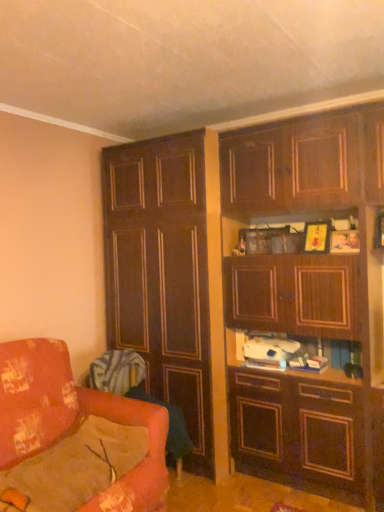
Describe the element at coordinates (169, 428) in the screenshot. I see `velvet orange swivel chair at lower left, the second swivel chair from the top` at that location.

The image size is (384, 512). What do you see at coordinates (138, 396) in the screenshot?
I see `velvet orange swivel chair at lower left, arranged as the 1th swivel chair when viewed from the top` at bounding box center [138, 396].

Find the location of a particular element. Image resolution: width=384 pixels, height=512 pixels. velvet orange swivel chair at lower left, arranged as the 1th swivel chair when viewed from the top is located at coordinates (138, 396).

Find the location of a particular element. Image resolution: width=384 pixels, height=512 pixels. dark wood cabinet at left, the first cabinetry in the left-to-right sequence is located at coordinates (162, 274).

Where is `velvet orange swivel chair at lower left, acting as the 1th swivel chair starting from the bottom`? The height and width of the screenshot is (512, 384). velvet orange swivel chair at lower left, acting as the 1th swivel chair starting from the bottom is located at coordinates (169, 428).

Visually, is floral fabric couch at lower left positioned to the left or to the right of velvet orange swivel chair at lower left, the second swivel chair from the top?

Based on their positions, floral fabric couch at lower left is located to the left of velvet orange swivel chair at lower left, the second swivel chair from the top.

From the image's perspective, is floral fabric couch at lower left located above velvet orange swivel chair at lower left, acting as the 1th swivel chair starting from the bottom?

Yes, from the image's perspective, floral fabric couch at lower left is on top of velvet orange swivel chair at lower left, acting as the 1th swivel chair starting from the bottom.

Considering the points (123, 502) and (181, 472), which point is behind, point (123, 502) or point (181, 472)?

The point (181, 472) is farther.

How far apart are floral fabric couch at lower left and velvet orange swivel chair at lower left, the second swivel chair from the top?

They are 25.42 inches apart.

Is velvet orange swivel chair at lower left, the second swivel chair from the top, facing towards floral fabric couch at lower left?

No, velvet orange swivel chair at lower left, the second swivel chair from the top, does not turn towards floral fabric couch at lower left.

Is velvet orange swivel chair at lower left, the second swivel chair from the top, in front of or behind floral fabric couch at lower left in the image?

velvet orange swivel chair at lower left, the second swivel chair from the top, is positioned farther from the viewer than floral fabric couch at lower left.

From a real-world perspective, is velvet orange swivel chair at lower left, the second swivel chair from the top, above or below floral fabric couch at lower left?

velvet orange swivel chair at lower left, the second swivel chair from the top, is below floral fabric couch at lower left.

Starting from the floral fabric couch at lower left, which swivel chair is the 2nd one to the right? Please provide its 2D coordinates.

[(169, 428)]

Is dark wood cabinet at left, positioned as the 2th cabinetry in right-to-left order, at the right side of wooden cabinet at upper right, arranged as the 1th cabinetry when viewed from the right?

No.

Is dark wood cabinet at left, positioned as the 2th cabinetry in right-to-left order, far from wooden cabinet at upper right, which ranks as the second cabinetry in left-to-right order?

Actually, dark wood cabinet at left, positioned as the 2th cabinetry in right-to-left order, and wooden cabinet at upper right, which ranks as the second cabinetry in left-to-right order, are a little close together.

From a real-world perspective, who is located lower, dark wood cabinet at left, the first cabinetry in the left-to-right sequence, or wooden cabinet at upper right, arranged as the 1th cabinetry when viewed from the right?

From a 3D spatial view, dark wood cabinet at left, the first cabinetry in the left-to-right sequence, is below.

What's the angular difference between dark wood cabinet at left, the first cabinetry in the left-to-right sequence, and wooden cabinet at upper right, which ranks as the second cabinetry in left-to-right order,'s facing directions?

The angle between the facing direction of dark wood cabinet at left, the first cabinetry in the left-to-right sequence, and the facing direction of wooden cabinet at upper right, which ranks as the second cabinetry in left-to-right order, is 0.000155 degrees.

Which is farther from the camera, (x=169, y=436) or (x=136, y=424)?

The point (x=169, y=436) is more distant.

Is velvet orange swivel chair at lower left, arranged as the 1th swivel chair when viewed from the top, spatially inside floral fabric couch at lower left, or outside of it?

velvet orange swivel chair at lower left, arranged as the 1th swivel chair when viewed from the top, lies outside floral fabric couch at lower left.

Can you see velvet orange swivel chair at lower left, arranged as the 1th swivel chair when viewed from the top, touching floral fabric couch at lower left?

No, velvet orange swivel chair at lower left, arranged as the 1th swivel chair when viewed from the top, is not making contact with floral fabric couch at lower left.

From a real-world perspective, is velvet orange swivel chair at lower left, the 2th swivel chair in the bottom-to-top sequence, on floral fabric couch at lower left?

No, from a real-world perspective, velvet orange swivel chair at lower left, the 2th swivel chair in the bottom-to-top sequence, is not on top of floral fabric couch at lower left.

Considering the positions of objects velvet orange swivel chair at lower left, the 2th swivel chair in the bottom-to-top sequence, and velvet orange swivel chair at lower left, the second swivel chair from the top, in the image provided, who is more to the left, velvet orange swivel chair at lower left, the 2th swivel chair in the bottom-to-top sequence, or velvet orange swivel chair at lower left, the second swivel chair from the top,?

velvet orange swivel chair at lower left, the 2th swivel chair in the bottom-to-top sequence, is more to the left.

Which is behind, point (129, 381) or point (174, 445)?

The point (129, 381) is farther.

The width and height of the screenshot is (384, 512). Find the location of `swivel chair above the velvet orange swivel chair at lower left, the second swivel chair from the top (from a real-world perspective)`. swivel chair above the velvet orange swivel chair at lower left, the second swivel chair from the top (from a real-world perspective) is located at coordinates (138, 396).

Between velvet orange swivel chair at lower left, arranged as the 1th swivel chair when viewed from the top, and velvet orange swivel chair at lower left, acting as the 1th swivel chair starting from the bottom, which one has smaller width?

Thinner between the two is velvet orange swivel chair at lower left, arranged as the 1th swivel chair when viewed from the top.

Would you say floral fabric couch at lower left is to the left or to the right of velvet orange swivel chair at lower left, arranged as the 1th swivel chair when viewed from the top, in the picture?

In the image, floral fabric couch at lower left appears on the left side of velvet orange swivel chair at lower left, arranged as the 1th swivel chair when viewed from the top.

Could you tell me if floral fabric couch at lower left is turned towards velvet orange swivel chair at lower left, the 2th swivel chair in the bottom-to-top sequence?

No, floral fabric couch at lower left is not facing towards velvet orange swivel chair at lower left, the 2th swivel chair in the bottom-to-top sequence.

Is floral fabric couch at lower left not inside velvet orange swivel chair at lower left, arranged as the 1th swivel chair when viewed from the top?

Yes, floral fabric couch at lower left is not within velvet orange swivel chair at lower left, arranged as the 1th swivel chair when viewed from the top.

In the image, is floral fabric couch at lower left positioned in front of or behind velvet orange swivel chair at lower left, arranged as the 1th swivel chair when viewed from the top?

In the image, floral fabric couch at lower left appears in front of velvet orange swivel chair at lower left, arranged as the 1th swivel chair when viewed from the top.

Relative to floral fabric couch at lower left, is dark wood cabinet at left, positioned as the 2th cabinetry in right-to-left order, in front or behind?

Clearly, dark wood cabinet at left, positioned as the 2th cabinetry in right-to-left order, is behind floral fabric couch at lower left.

From the image's perspective, which is above, dark wood cabinet at left, positioned as the 2th cabinetry in right-to-left order, or floral fabric couch at lower left?

From the image's view, dark wood cabinet at left, positioned as the 2th cabinetry in right-to-left order, is above.

Does dark wood cabinet at left, the first cabinetry in the left-to-right sequence, have a lesser width compared to floral fabric couch at lower left?

Correct, the width of dark wood cabinet at left, the first cabinetry in the left-to-right sequence, is less than that of floral fabric couch at lower left.

Is dark wood cabinet at left, positioned as the 2th cabinetry in right-to-left order, facing away from floral fabric couch at lower left?

That's not correct — dark wood cabinet at left, positioned as the 2th cabinetry in right-to-left order, is not looking away from floral fabric couch at lower left.

There is a velvet orange swivel chair at lower left, the second swivel chair from the top. Identify the location of studio couch above it (from a real-world perspective). The image size is (384, 512). (74, 439).

Find the location of a particular element. The image size is (384, 512). studio couch to the left of velvet orange swivel chair at lower left, the second swivel chair from the top is located at coordinates (74, 439).

In the scene shown: Which object lies nearer to the anchor point velvet orange swivel chair at lower left, the second swivel chair from the top, wooden cabinet at upper right, which ranks as the second cabinetry in left-to-right order, or dark wood cabinet at left, positioned as the 2th cabinetry in right-to-left order?

dark wood cabinet at left, positioned as the 2th cabinetry in right-to-left order.

Looking at the image, which one is located further to velvet orange swivel chair at lower left, the 2th swivel chair in the bottom-to-top sequence, wooden cabinet at upper right, which ranks as the second cabinetry in left-to-right order, or floral fabric couch at lower left?

Based on the image, wooden cabinet at upper right, which ranks as the second cabinetry in left-to-right order, appears to be further to velvet orange swivel chair at lower left, the 2th swivel chair in the bottom-to-top sequence.

Based on the photo, looking at the image, which one is located further to wooden cabinet at upper right, which ranks as the second cabinetry in left-to-right order, dark wood cabinet at left, positioned as the 2th cabinetry in right-to-left order, or velvet orange swivel chair at lower left, the 2th swivel chair in the bottom-to-top sequence?

Based on the image, velvet orange swivel chair at lower left, the 2th swivel chair in the bottom-to-top sequence, appears to be further to wooden cabinet at upper right, which ranks as the second cabinetry in left-to-right order.

Consider the image. Based on their spatial positions, is dark wood cabinet at left, positioned as the 2th cabinetry in right-to-left order, or velvet orange swivel chair at lower left, the second swivel chair from the top, further from wooden cabinet at upper right, which ranks as the second cabinetry in left-to-right order?

Among the two, velvet orange swivel chair at lower left, the second swivel chair from the top, is located further to wooden cabinet at upper right, which ranks as the second cabinetry in left-to-right order.

Estimate the real-world distances between objects in this image. Which object is further from wooden cabinet at upper right, which ranks as the second cabinetry in left-to-right order, dark wood cabinet at left, positioned as the 2th cabinetry in right-to-left order, or floral fabric couch at lower left?

Based on the image, floral fabric couch at lower left appears to be further to wooden cabinet at upper right, which ranks as the second cabinetry in left-to-right order.

Looking at the image, which one is located closer to floral fabric couch at lower left, wooden cabinet at upper right, arranged as the 1th cabinetry when viewed from the right, or dark wood cabinet at left, positioned as the 2th cabinetry in right-to-left order?

dark wood cabinet at left, positioned as the 2th cabinetry in right-to-left order, lies closer to floral fabric couch at lower left than the other object.

Which object lies nearer to the anchor point floral fabric couch at lower left, wooden cabinet at upper right, which ranks as the second cabinetry in left-to-right order, or velvet orange swivel chair at lower left, the 2th swivel chair in the bottom-to-top sequence?

The object closer to floral fabric couch at lower left is velvet orange swivel chair at lower left, the 2th swivel chair in the bottom-to-top sequence.

When comparing their distances from dark wood cabinet at left, the first cabinetry in the left-to-right sequence, does velvet orange swivel chair at lower left, acting as the 1th swivel chair starting from the bottom, or wooden cabinet at upper right, which ranks as the second cabinetry in left-to-right order, seem further?

Among the two, velvet orange swivel chair at lower left, acting as the 1th swivel chair starting from the bottom, is located further to dark wood cabinet at left, the first cabinetry in the left-to-right sequence.

Where is `swivel chair between dark wood cabinet at left, the first cabinetry in the left-to-right sequence, and velvet orange swivel chair at lower left, the second swivel chair from the top, in the up-down direction`? Image resolution: width=384 pixels, height=512 pixels. swivel chair between dark wood cabinet at left, the first cabinetry in the left-to-right sequence, and velvet orange swivel chair at lower left, the second swivel chair from the top, in the up-down direction is located at coordinates (138, 396).

The width and height of the screenshot is (384, 512). Find the location of `cabinetry situated between floral fabric couch at lower left and wooden cabinet at upper right, arranged as the 1th cabinetry when viewed from the right, from left to right`. cabinetry situated between floral fabric couch at lower left and wooden cabinet at upper right, arranged as the 1th cabinetry when viewed from the right, from left to right is located at coordinates (162, 274).

Identify the location of swivel chair between velvet orange swivel chair at lower left, the 2th swivel chair in the bottom-to-top sequence, and wooden cabinet at upper right, arranged as the 1th cabinetry when viewed from the right. (169, 428).

What are the coordinates of `cabinetry situated between velvet orange swivel chair at lower left, arranged as the 1th swivel chair when viewed from the top, and wooden cabinet at upper right, which ranks as the second cabinetry in left-to-right order, from left to right` in the screenshot? It's located at (162, 274).